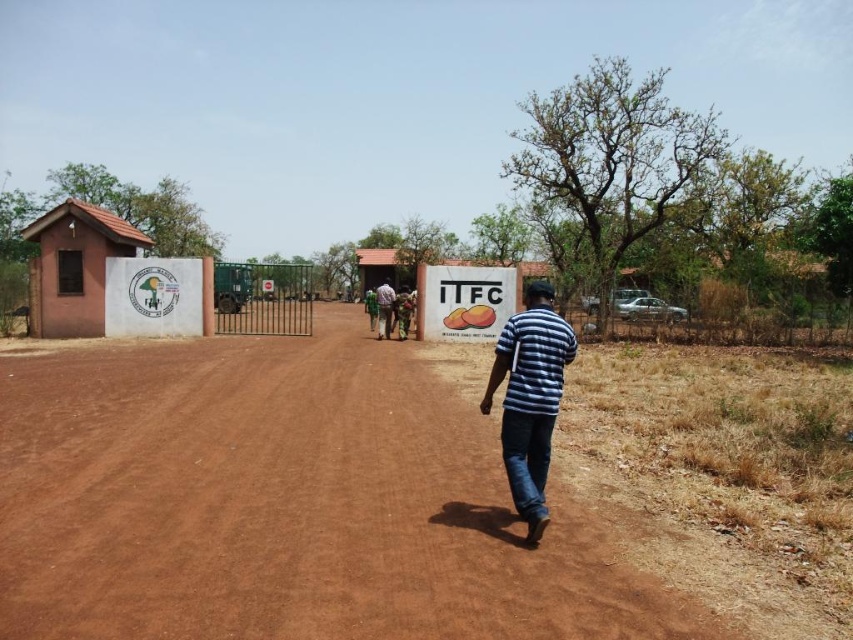
Can you confirm if brown clay hut at left is positioned to the right of white paper sign at center?

Incorrect, brown clay hut at left is not on the right side of white paper sign at center.

The width and height of the screenshot is (853, 640). What do you see at coordinates (74, 266) in the screenshot?
I see `brown clay hut at left` at bounding box center [74, 266].

The width and height of the screenshot is (853, 640). I want to click on brown clay hut at left, so [74, 266].

What do you see at coordinates (286, 502) in the screenshot?
I see `brown dirt track at center` at bounding box center [286, 502].

Between brown dirt track at center and green fabric shirt at center, which one appears on the left side from the viewer's perspective?

From the viewer's perspective, green fabric shirt at center appears more on the left side.

Is point (213, 490) less distant than point (390, 314)?

Yes.

This screenshot has height=640, width=853. Identify the location of brown dirt track at center. (286, 502).

Is striped fabric shirt at center above white paper sign at center?

No.

How much distance is there between striped fabric shirt at center and white paper sign at center?

striped fabric shirt at center is 49.92 feet away from white paper sign at center.

Find the location of a particular element. The image size is (853, 640). striped fabric shirt at center is located at coordinates tap(531, 397).

In order to click on striped fabric shirt at center in this screenshot , I will do `click(531, 397)`.